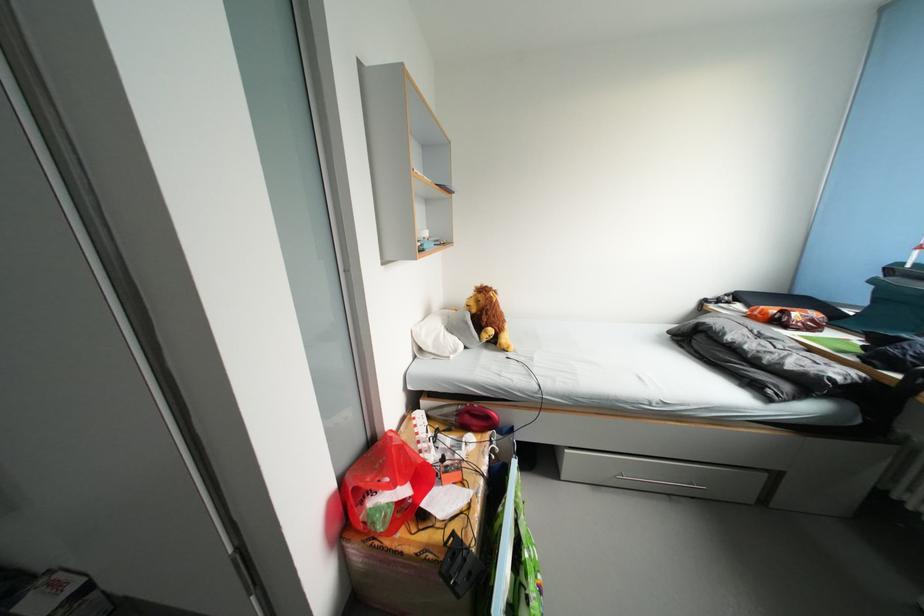
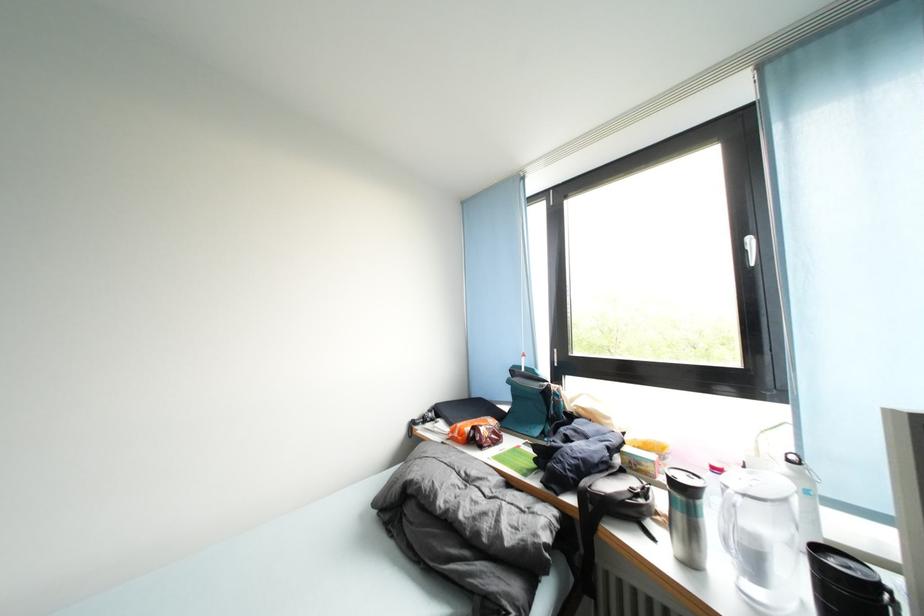
Based on the continuous images, in which direction is the camera rotating?

The rotation direction of the camera is right-up.